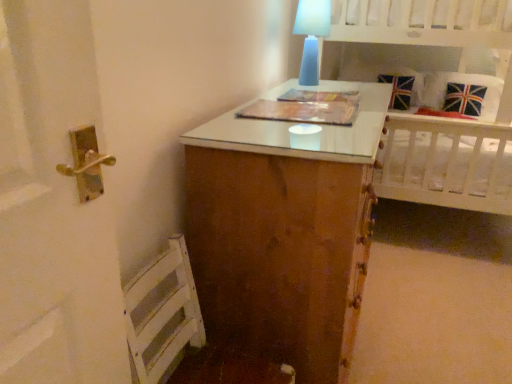
Question: Is union jack fabric pillow at upper right far from blue frosted glass table lamp at upper center?

Choices:
 (A) no
 (B) yes

Answer: (B)

Question: Can you confirm if union jack fabric pillow at upper right is positioned to the right of blue frosted glass table lamp at upper center?

Choices:
 (A) no
 (B) yes

Answer: (B)

Question: Considering the relative sizes of union jack fabric pillow at upper right and blue frosted glass table lamp at upper center in the image provided, is union jack fabric pillow at upper right wider than blue frosted glass table lamp at upper center?

Choices:
 (A) no
 (B) yes

Answer: (B)

Question: From the image's perspective, is union jack fabric pillow at upper right beneath blue frosted glass table lamp at upper center?

Choices:
 (A) yes
 (B) no

Answer: (B)

Question: Would you say union jack fabric pillow at upper right contains blue frosted glass table lamp at upper center?

Choices:
 (A) no
 (B) yes

Answer: (A)

Question: Considering the positions of white wooden bed at upper right and union jack fabric pillow at upper right in the image, is white wooden bed at upper right taller or shorter than union jack fabric pillow at upper right?

Choices:
 (A) short
 (B) tall

Answer: (B)

Question: From a real-world perspective, relative to union jack fabric pillow at upper right, is white wooden bed at upper right vertically above or below?

Choices:
 (A) above
 (B) below

Answer: (A)

Question: Choose the correct answer: Is white wooden bed at upper right inside union jack fabric pillow at upper right or outside it?

Choices:
 (A) outside
 (B) inside

Answer: (A)

Question: Considering the positions of point (390, 39) and point (439, 97), is point (390, 39) closer or farther from the camera than point (439, 97)?

Choices:
 (A) farther
 (B) closer

Answer: (B)

Question: In terms of width, does blue frosted glass table lamp at upper center look wider or thinner when compared to white wooden bed at upper right?

Choices:
 (A) wide
 (B) thin

Answer: (B)

Question: In the image, is blue frosted glass table lamp at upper center positioned in front of or behind white wooden bed at upper right?

Choices:
 (A) behind
 (B) front

Answer: (A)

Question: From a real-world perspective, is blue frosted glass table lamp at upper center physically located above or below white wooden bed at upper right?

Choices:
 (A) below
 (B) above

Answer: (B)

Question: In terms of height, does blue frosted glass table lamp at upper center look taller or shorter compared to white wooden bed at upper right?

Choices:
 (A) tall
 (B) short

Answer: (B)

Question: Is union jack fabric pillow at upper right to the left or to the right of white wooden bed at upper right in the image?

Choices:
 (A) left
 (B) right

Answer: (B)

Question: From a real-world perspective, is union jack fabric pillow at upper right physically located above or below white wooden bed at upper right?

Choices:
 (A) below
 (B) above

Answer: (A)